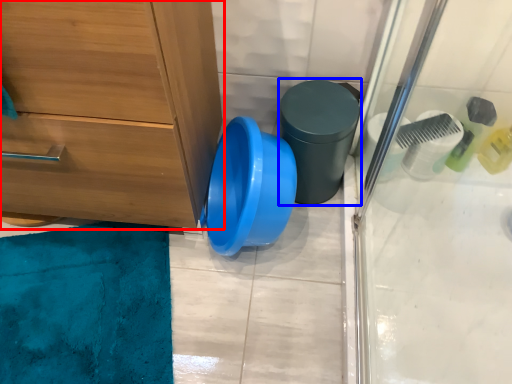
Question: Which object appears closest to the camera in this image, chest of drawers (highlighted by a red box) or potty (highlighted by a blue box)?

Choices:
 (A) chest of drawers
 (B) potty

Answer: (A)